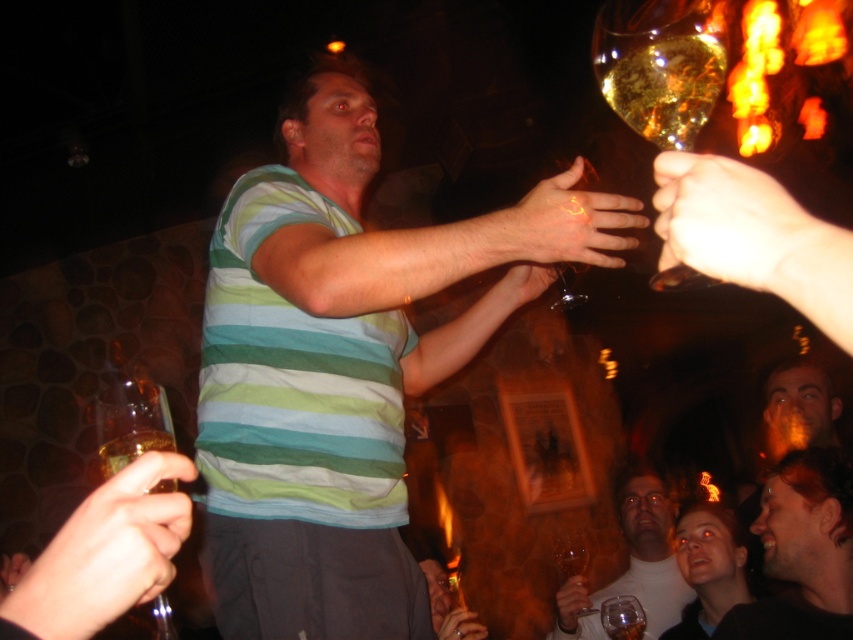
Question: Which object appears closest to the camera in this image?

Choices:
 (A) striped cotton shirt at center
 (B) translucent amber glass at upper right
 (C) translucent glass wine at center

Answer: (C)

Question: Does translucent amber glass at upper right appear under translucent glass wine glass at lower center?

Choices:
 (A) no
 (B) yes

Answer: (A)

Question: Which point is closer to the camera taking this photo?

Choices:
 (A) (817, 616)
 (B) (651, 625)

Answer: (A)

Question: Which point is closer to the camera?

Choices:
 (A) (283, 288)
 (B) (796, 396)
 (C) (605, 49)
 (D) (746, 224)

Answer: (D)

Question: Can you confirm if smooth brown hair at upper right is thinner than translucent glass wine at center?

Choices:
 (A) no
 (B) yes

Answer: (A)

Question: Is yellow-orange wax at center thinner than translucent amber glass at upper center?

Choices:
 (A) yes
 (B) no

Answer: (B)